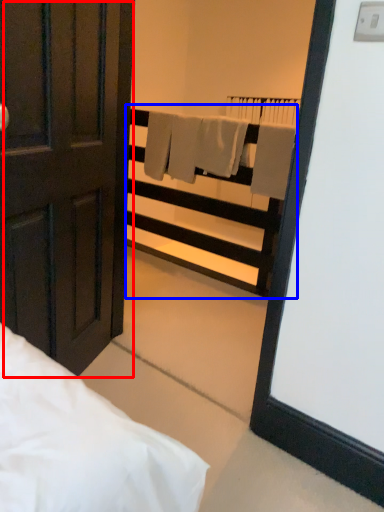
Question: Among these objects, which one is nearest to the camera, door (highlighted by a red box) or balustrade (highlighted by a blue box)?

Choices:
 (A) door
 (B) balustrade

Answer: (A)